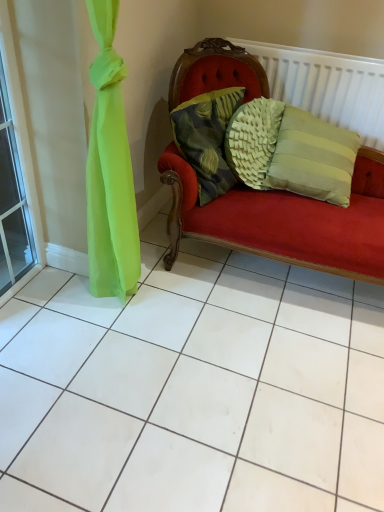
Question: From their relative heights in the image, would you say white textured radiator at upper right is taller or shorter than textured green pillow at center?

Choices:
 (A) short
 (B) tall

Answer: (B)

Question: From the image's perspective, is white textured radiator at upper right positioned above or below textured green pillow at center?

Choices:
 (A) below
 (B) above

Answer: (B)

Question: Which object is the closest to the white textured radiator at upper right?

Choices:
 (A) transparent glass window at left
 (B) textured green pillow at center

Answer: (B)

Question: Which is nearer to the white textured radiator at upper right?

Choices:
 (A) transparent glass window at left
 (B) textured green pillow at center

Answer: (B)